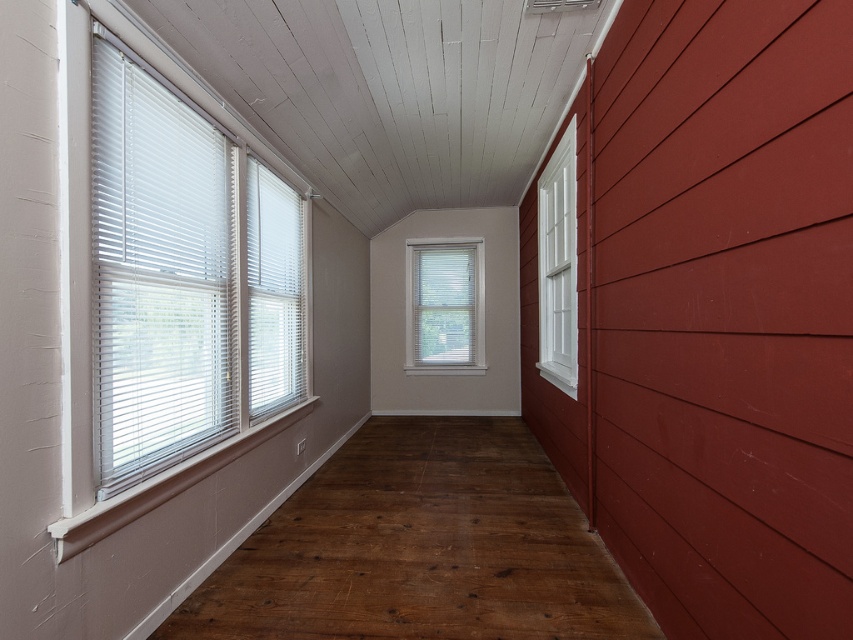
You are standing in the hallway and want to step onto the dark brown wood floor at left. Based on its coordinates, where exactly should you place your foot?

The dark brown wood floor at left is located at coordinates point [421,547], so you should place your foot there to step onto it.

Looking at this image, you are moving a 1.2 meter wide sofa through the hallway. The sofa must pass between the dark brown wood floor at left and the white blinds at left. Can the sofa fit through this space?

The dark brown wood floor at left is wider than the white blinds at left. Since the sofa is 1.2 meters wide, it can fit through the space as the floor is wider than the blinds, but you should ensure there are no other obstacles in the path.